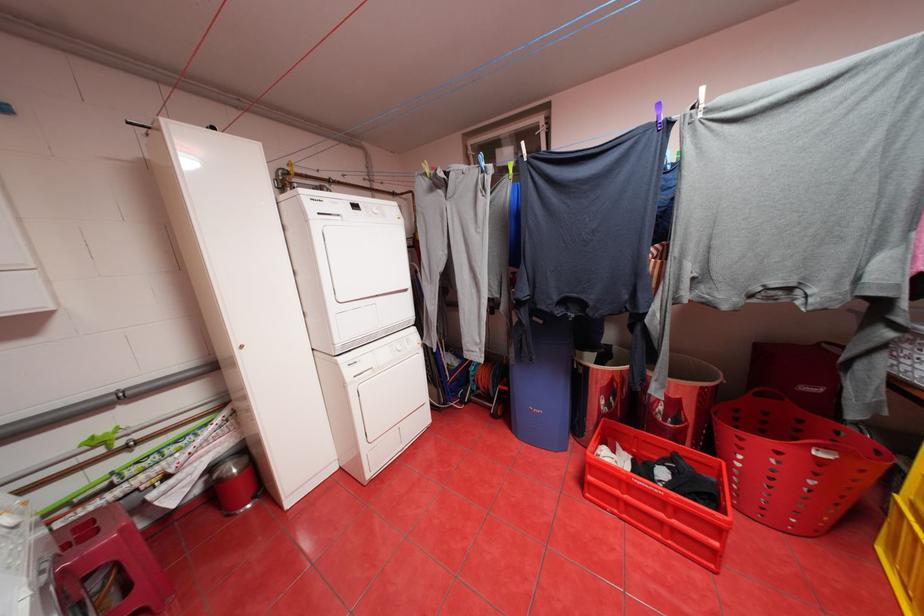
You are a GUI agent. You are given a task and a screenshot of the screen. Output one action in this format:
    pyautogui.click(x=<x>, y=<y>)
    Task: Click on the lower dryer door
    
    Given the screenshot: What is the action you would take?
    click(392, 395)